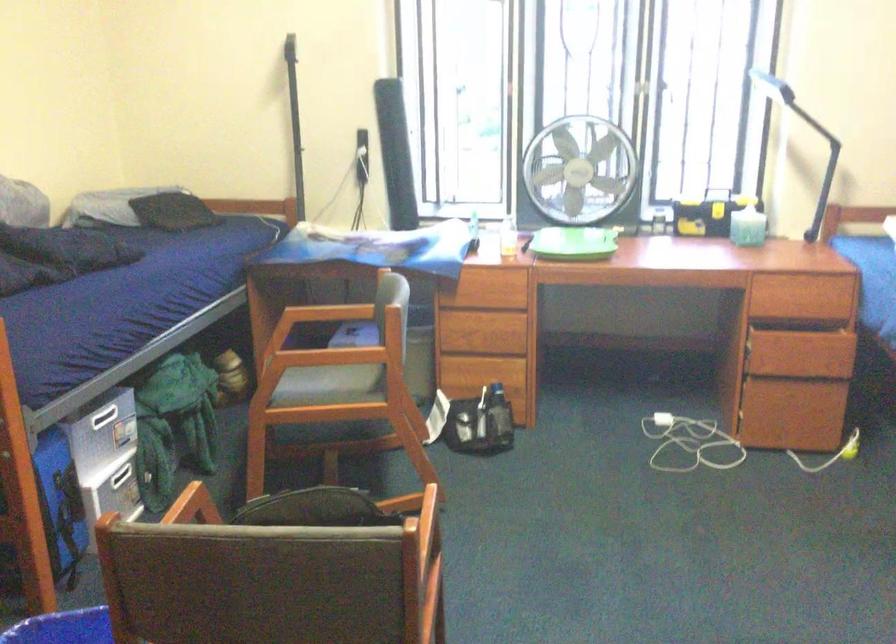
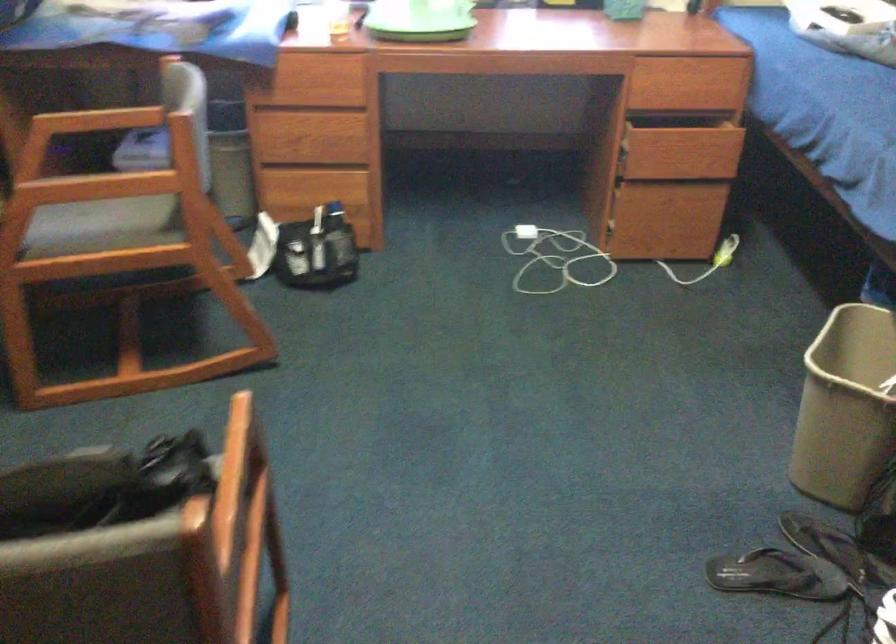
Question: How did the camera likely rotate?

Choices:
 (A) Left
 (B) Right
 (C) Up
 (D) Down

Answer: (D)